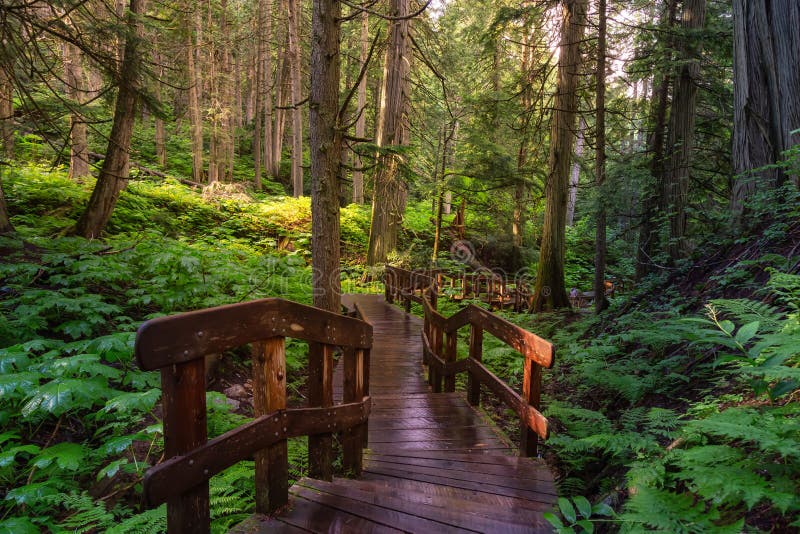
Find the location of a particular element. Image resolution: width=800 pixels, height=534 pixels. left railing is located at coordinates (298, 328).